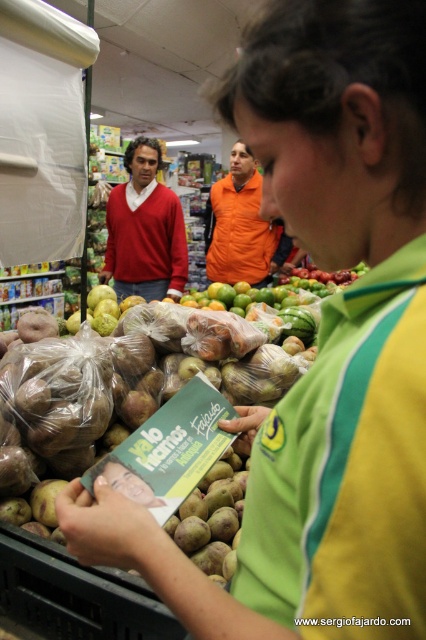
Question: Which object appears closest to the camera in this image?

Choices:
 (A) matte red sweater at upper left
 (B) orange fabric shirt at center

Answer: (A)

Question: Is matte red sweater at upper left bigger than orange fabric shirt at center?

Choices:
 (A) no
 (B) yes

Answer: (A)

Question: Is matte red sweater at upper left to the left of orange fabric shirt at center from the viewer's perspective?

Choices:
 (A) yes
 (B) no

Answer: (A)

Question: Among these objects, which one is nearest to the camera?

Choices:
 (A) orange fabric shirt at center
 (B) matte red sweater at upper left

Answer: (B)

Question: Does matte red sweater at upper left appear over orange fabric shirt at center?

Choices:
 (A) no
 (B) yes

Answer: (A)